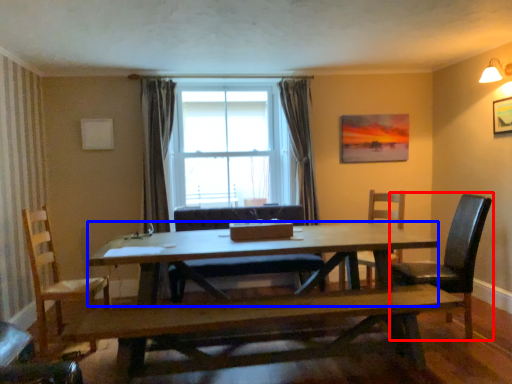
Question: Among these objects, which one is nearest to the camera, chair (highlighted by a red box) or kitchen & dining room table (highlighted by a blue box)?

Choices:
 (A) chair
 (B) kitchen & dining room table

Answer: (B)